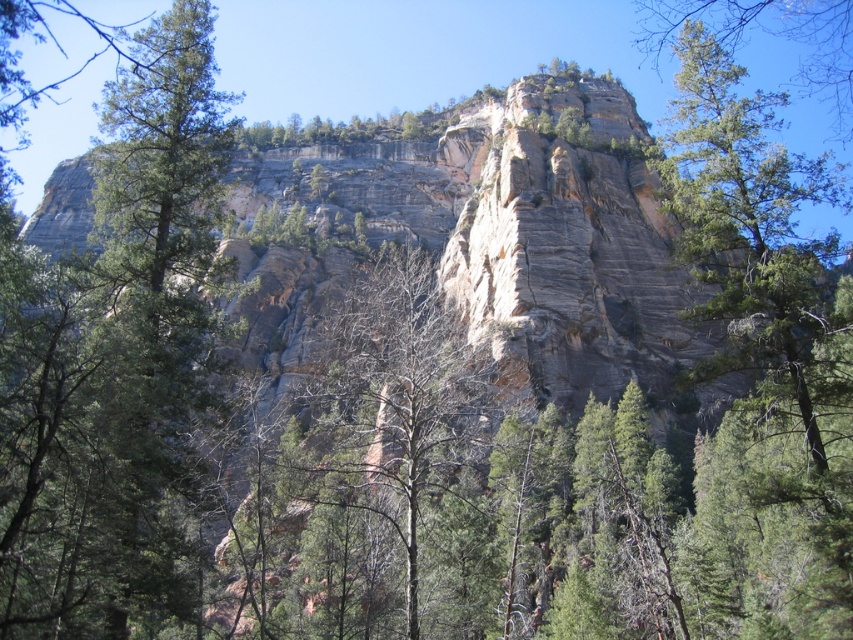
You are an environmental scientist studying the landscape. You observe the bare branches at center and the green textured tree at upper right. Which of these two trees is located to the right of the other?

The green textured tree at upper right is located to the right of the bare branches at center.

You are standing in the dense forest of evergreen trees in the foreground of the image. There is a point marked at coordinates (398,458). What can you find at that point?

At the point marked at coordinates (398,458), you can find bare branches at center.